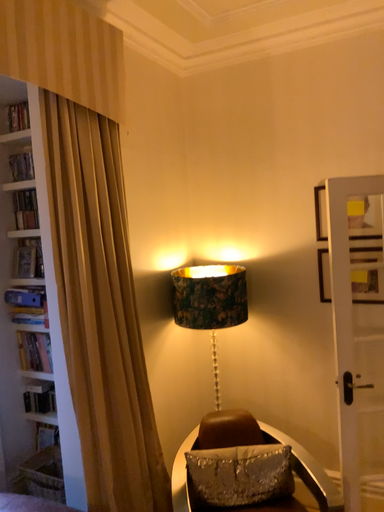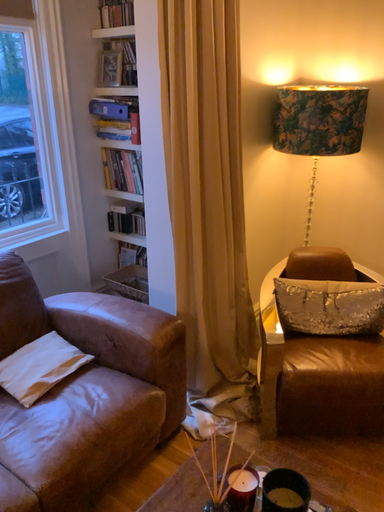
Question: How did the camera likely rotate when shooting the video?

Choices:
 (A) rotated upward
 (B) rotated downward

Answer: (B)